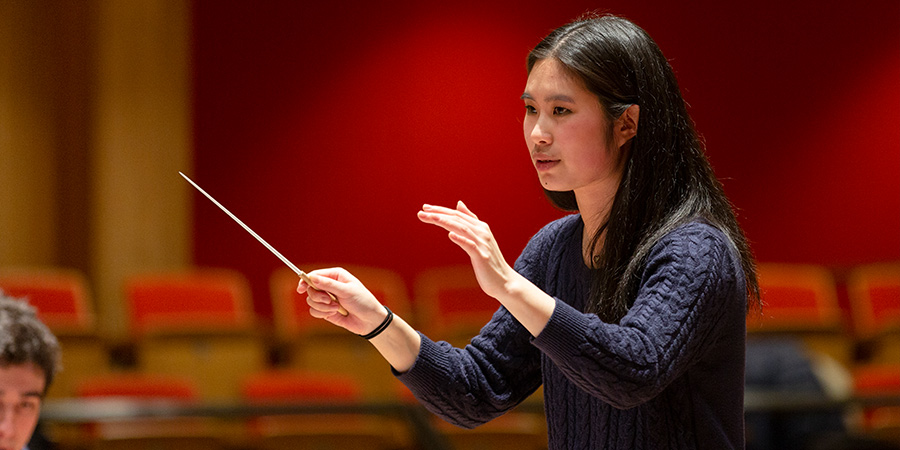
Locate an element on the screen. The height and width of the screenshot is (450, 900). reddish painted wall is located at coordinates (407, 128).